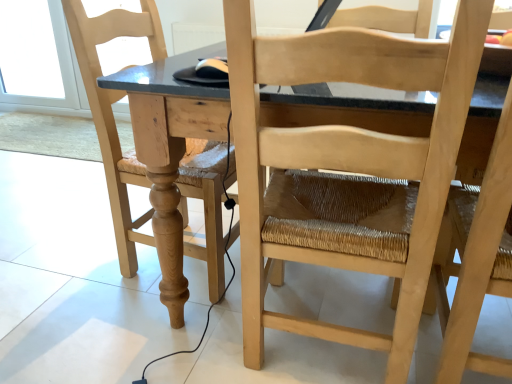
You are a GUI agent. You are given a task and a screenshot of the screen. Output one action in this format:
    pyautogui.click(x=<x>, y=<y>)
    Task: Click on the free spot in front of natural wood chair at left, the first chair in the left-to-right sequence
    
    Given the screenshot: What is the action you would take?
    pyautogui.click(x=114, y=335)